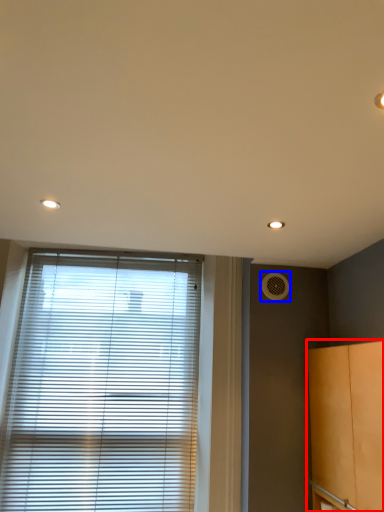
Question: Which object is closer to the camera taking this photo, cabinetry (highlighted by a red box) or air conditioning (highlighted by a blue box)?

Choices:
 (A) cabinetry
 (B) air conditioning

Answer: (A)